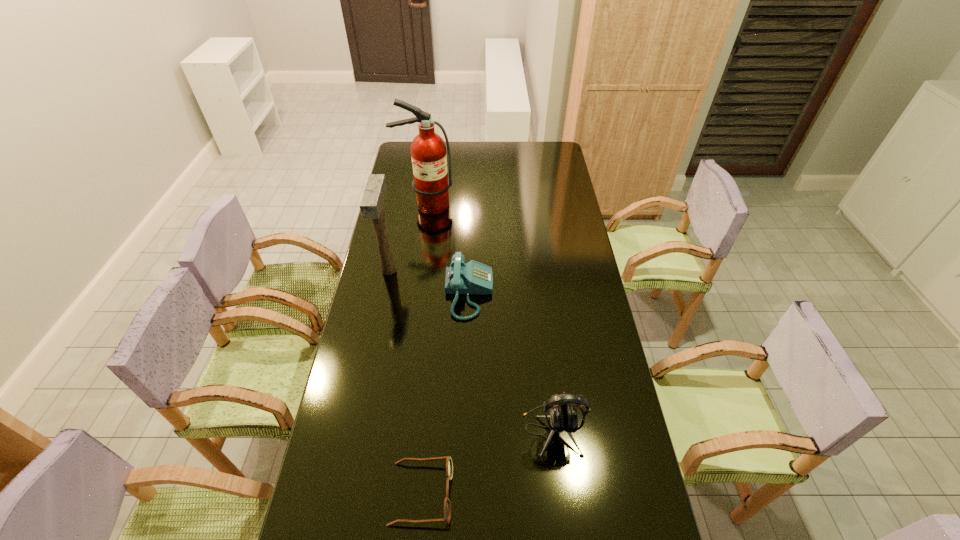
Locate an element on the screen. Image resolution: width=960 pixels, height=540 pixels. vacant point located between the spectacles and the second shortest object is located at coordinates (445, 393).

Find the location of a particular element. The width and height of the screenshot is (960, 540). free point between the fire extinguisher and the mallet is located at coordinates (407, 238).

Locate an element on the screen. free spot between the earphone and the nearest object is located at coordinates (487, 462).

The width and height of the screenshot is (960, 540). I want to click on free spot between the spectacles and the fire extinguisher, so click(x=423, y=349).

This screenshot has width=960, height=540. Find the location of `free space between the tallest object and the rightmost object`. free space between the tallest object and the rightmost object is located at coordinates (489, 318).

The width and height of the screenshot is (960, 540). In order to click on vacant area between the spectacles and the telephone in this screenshot , I will do [445, 393].

Locate an element on the screen. This screenshot has height=540, width=960. free spot between the second shortest object and the farthest object is located at coordinates (447, 249).

I want to click on free spot between the nearest object and the mallet, so click(x=405, y=382).

Identify the location of free area in between the telephone and the spectacles. The width and height of the screenshot is (960, 540). (445, 393).

The height and width of the screenshot is (540, 960). In order to click on the fourth closest object to the second tallest object in this screenshot , I will do `click(563, 417)`.